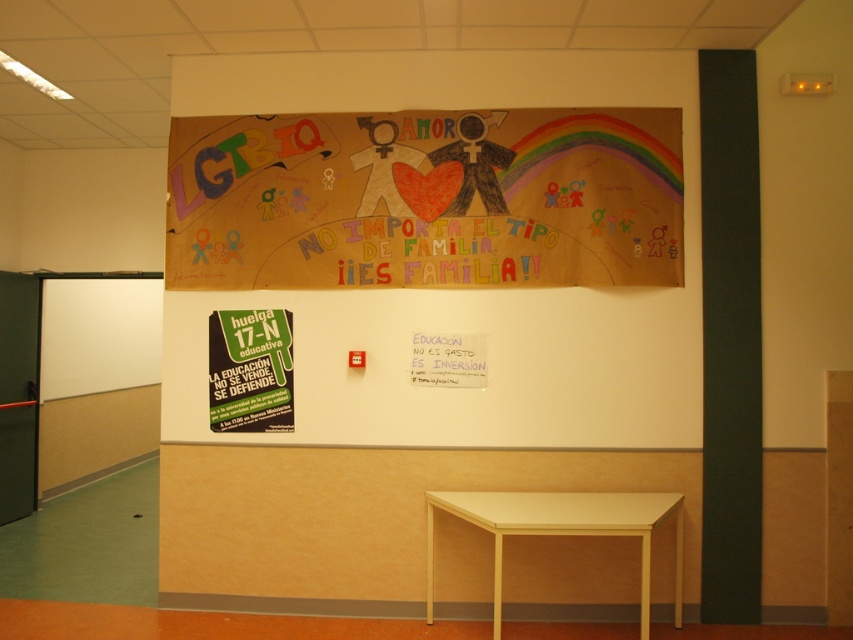
Question: Which object is the farthest from the cardboard banner at upper center?

Choices:
 (A) white matte table at lower center
 (B) white paper at upper center

Answer: (A)

Question: Can you confirm if cardboard banner at upper center is bigger than white paper at upper center?

Choices:
 (A) no
 (B) yes

Answer: (B)

Question: Which object is farther from the camera taking this photo?

Choices:
 (A) cardboard banner at upper center
 (B) white matte table at lower center

Answer: (A)

Question: Which point is closer to the camera?

Choices:
 (A) white matte table at lower center
 (B) cardboard banner at upper center
 (C) white paper at upper center

Answer: (A)

Question: Can you confirm if cardboard banner at upper center is thinner than white matte table at lower center?

Choices:
 (A) no
 (B) yes

Answer: (A)

Question: Is cardboard banner at upper center to the right of white paper at upper center from the viewer's perspective?

Choices:
 (A) yes
 (B) no

Answer: (B)